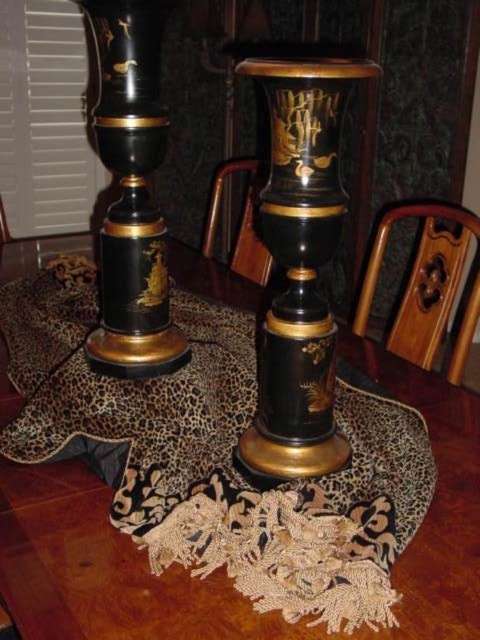
Can you confirm if black lacquer pedestal at center is positioned above glossy lacquer candle holder at left?

Incorrect, black lacquer pedestal at center is not positioned above glossy lacquer candle holder at left.

Does point (2, 502) come farther from viewer compared to point (144, 227)?

No.

Identify the location of black lacquer pedestal at center. (105, 572).

How much distance is there between black lacquer vase at center and glossy lacquer candle holder at left?

black lacquer vase at center is 10.32 inches from glossy lacquer candle holder at left.

Find the location of a particular element. black lacquer vase at center is located at coordinates (300, 266).

Does black lacquer pedestal at center have a greater width compared to black lacquer vase at center?

Yes, black lacquer pedestal at center is wider than black lacquer vase at center.

Which is more to the left, black lacquer pedestal at center or black lacquer vase at center?

From the viewer's perspective, black lacquer pedestal at center appears more on the left side.

Between point (448, 396) and point (300, 208), which one is positioned in front?

Positioned in front is point (300, 208).

Identify the location of black lacquer pedestal at center. (105, 572).